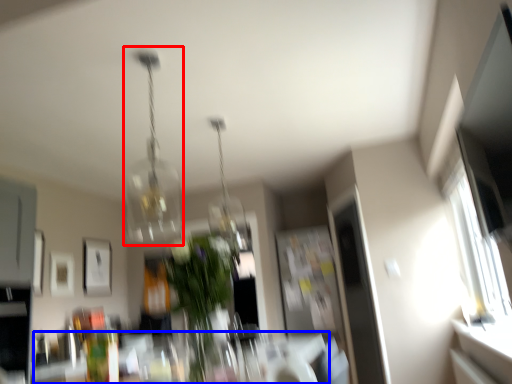
Question: Which object appears closest to the camera in this image, lamp (highlighted by a red box) or table (highlighted by a blue box)?

Choices:
 (A) lamp
 (B) table

Answer: (B)